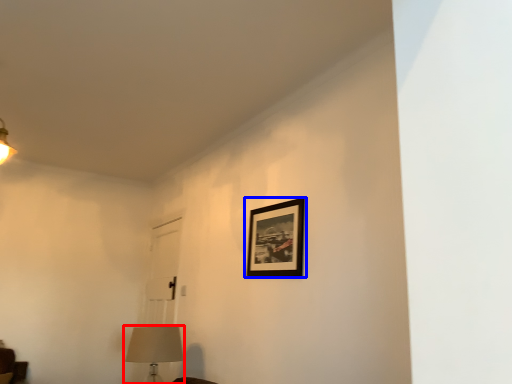
Question: Which of the following is the closest to the observer, table lamp (highlighted by a red box) or picture frame (highlighted by a blue box)?

Choices:
 (A) table lamp
 (B) picture frame

Answer: (B)